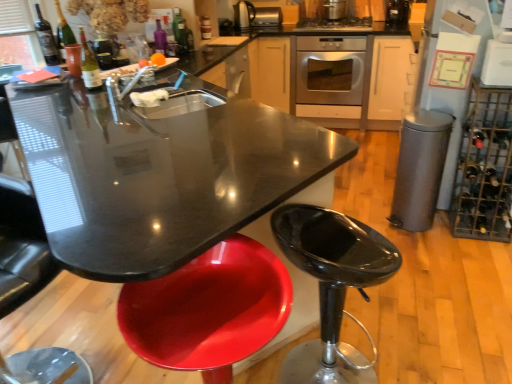
In order to click on vacant space that's between glossy plastic bar stool at lower right and metallic wire wine rack at right in this screenshot , I will do `click(425, 297)`.